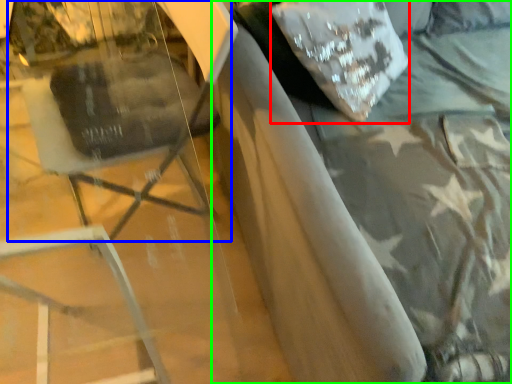
Question: Based on their relative distances, which object is farther from pillow (highlighted by a red box)? Choose from swivel chair (highlighted by a blue box) and bed (highlighted by a green box).

Choices:
 (A) swivel chair
 (B) bed

Answer: (A)